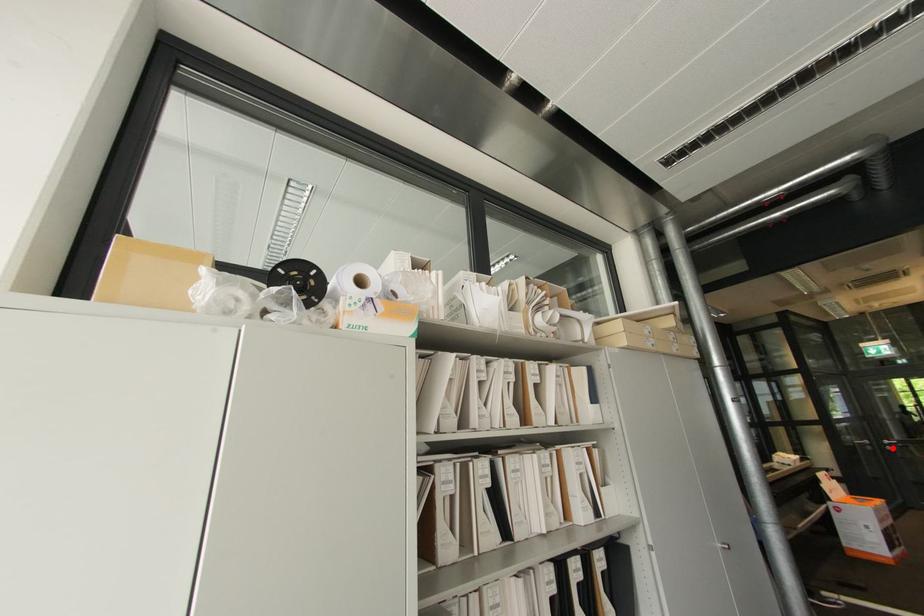
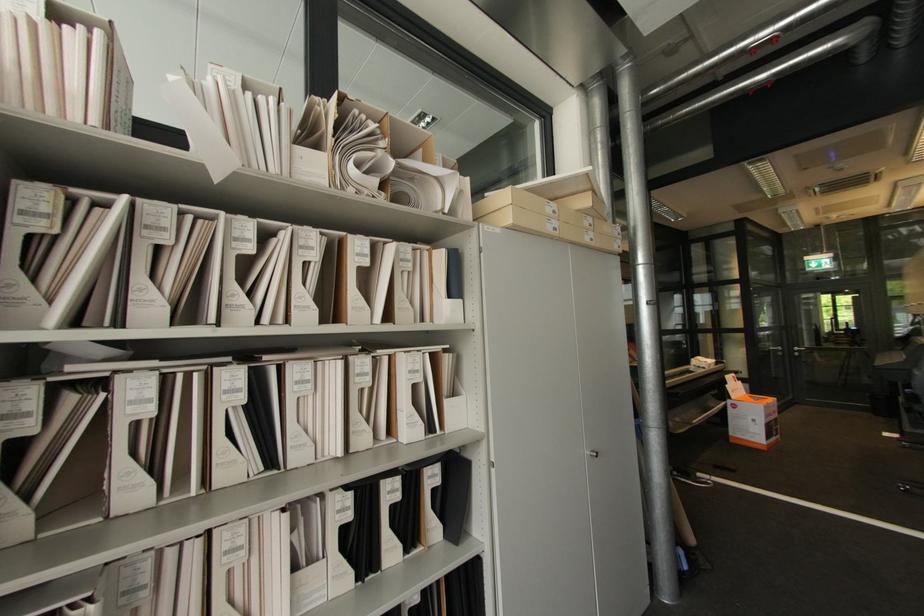
The point at the highlighted location is marked in the first image. Where is the corresponding point in the second image?

(800, 354)